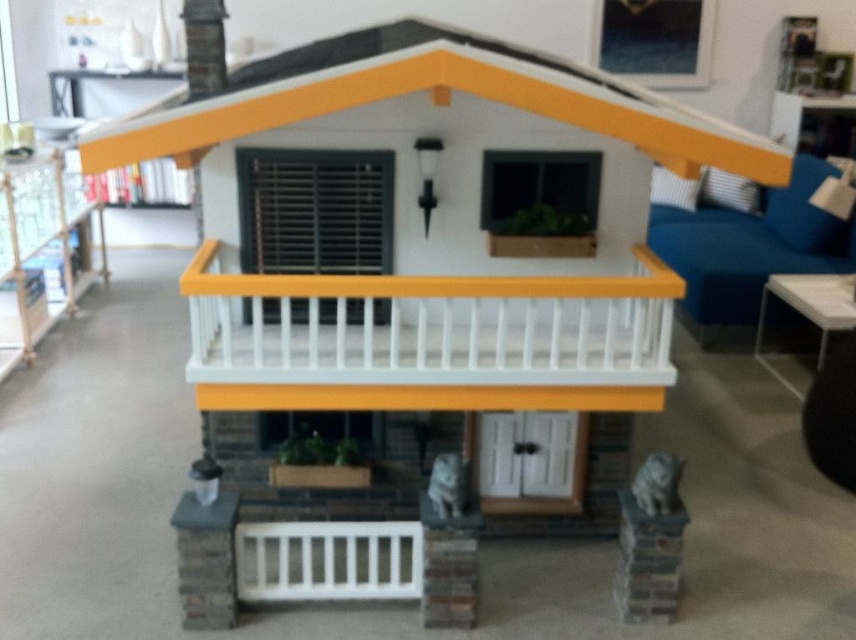
You are a delivery person trying to place a metallic silver bookshelf at left next to the white painted wood balustrade at center. Can you place the bookshelf to the left of the balustrade?

The white painted wood balustrade at center is positioned on the right side of the metallic silver bookshelf at left, so the bookshelf is already to the left of the balustrade.

You are a delivery person trying to place a large package on the porch of the house. The package is as big as the metallic silver bookshelf at left. Can you fit it on the porch without removing the white painted wood balustrade at center?

The white painted wood balustrade at center is smaller than the metallic silver bookshelf at left. Since the package is as big as the metallic silver bookshelf at left, it would not fit on the porch without removing the balustrade because the balustrade is smaller and may not have enough space.